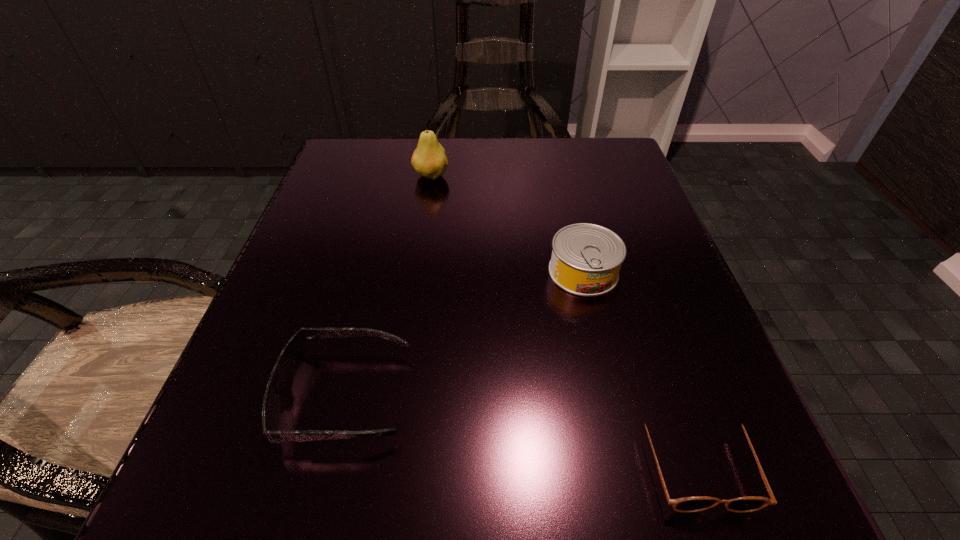
Locate an element on the screen. pear is located at coordinates (429, 160).

Locate an element on the screen. Image resolution: width=960 pixels, height=540 pixels. the tallest object is located at coordinates (429, 160).

Identify the location of can. This screenshot has width=960, height=540. [x=586, y=258].

The height and width of the screenshot is (540, 960). What are the coordinates of `the left sunglasses` in the screenshot? It's located at (292, 355).

Where is `the shortest object`? the shortest object is located at coordinates (746, 504).

The height and width of the screenshot is (540, 960). Identify the location of the shorter sunglasses. (746, 504).

In order to click on free point located 0.270m on the front of the pear in this screenshot , I will do `click(416, 281)`.

Find the location of `free space located on the front of the can`. free space located on the front of the can is located at coordinates (601, 345).

Where is `vacant region located on the front-facing side of the left sunglasses`? The height and width of the screenshot is (540, 960). vacant region located on the front-facing side of the left sunglasses is located at coordinates (564, 396).

Where is `object that is at the far edge`? This screenshot has height=540, width=960. object that is at the far edge is located at coordinates [x=429, y=160].